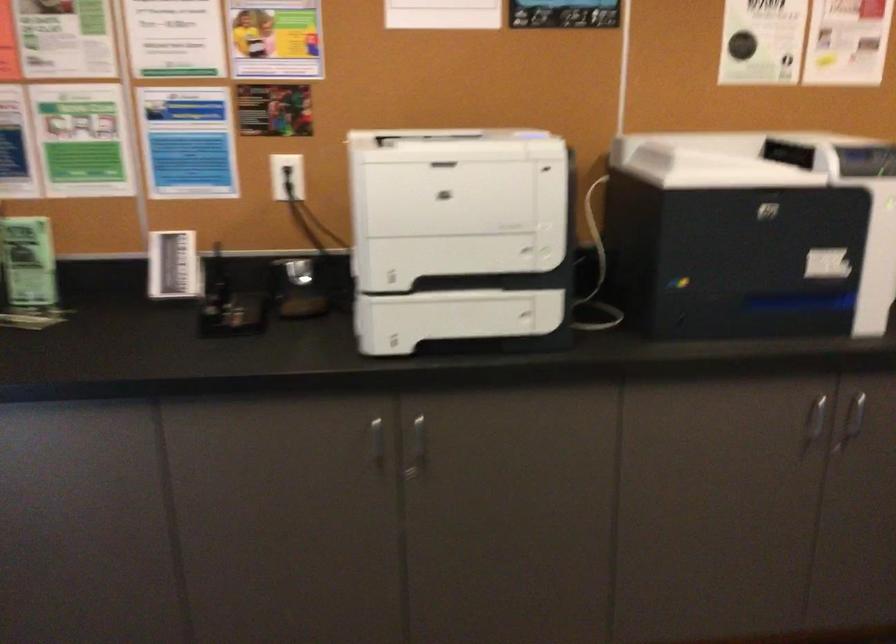
Find the location of a particular element. printer lid is located at coordinates (737, 259).